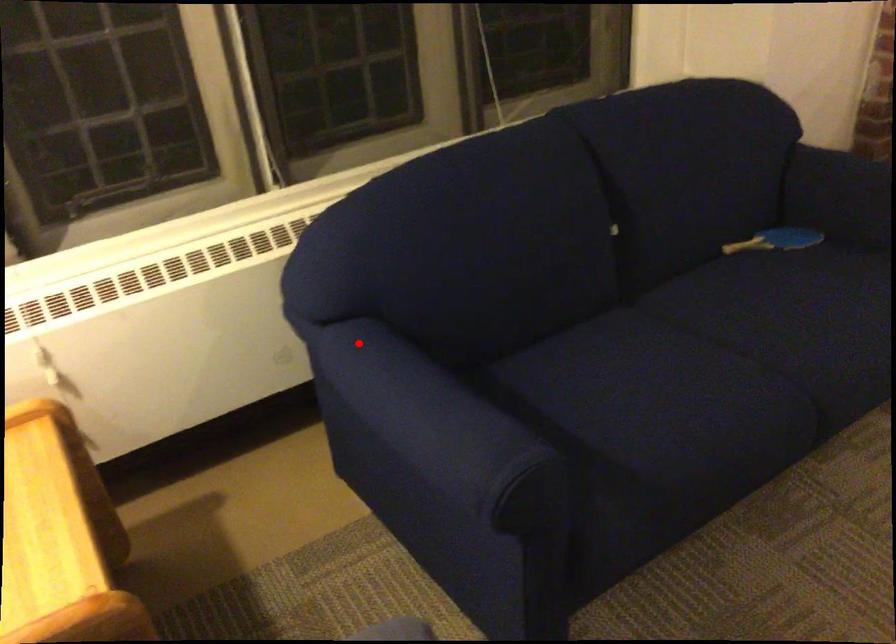
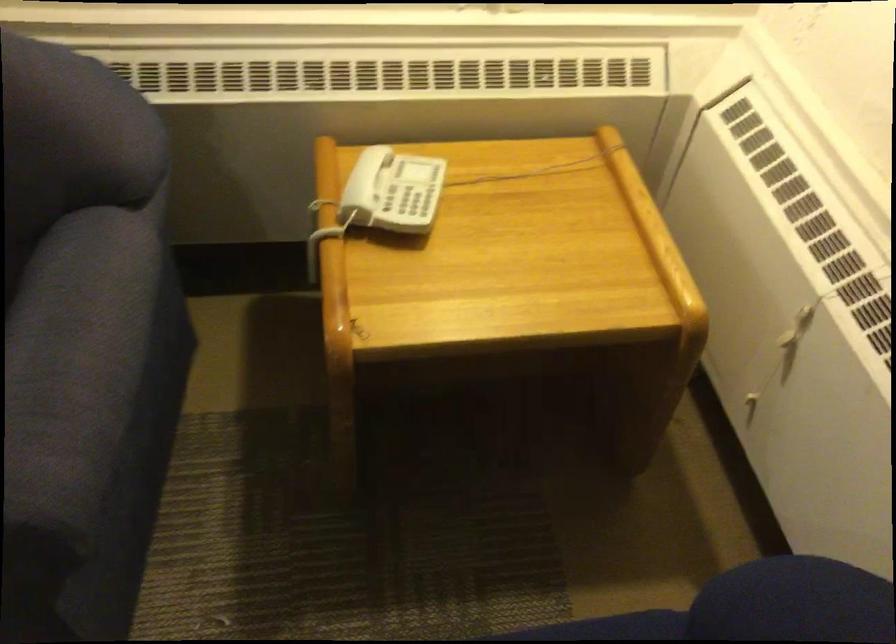
Where in the second image is the point corresponding to the highlighted location from the first image?

(612, 627)